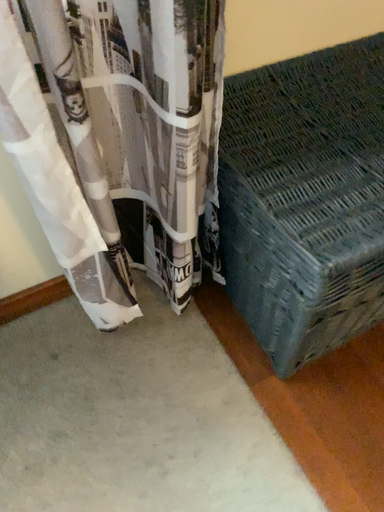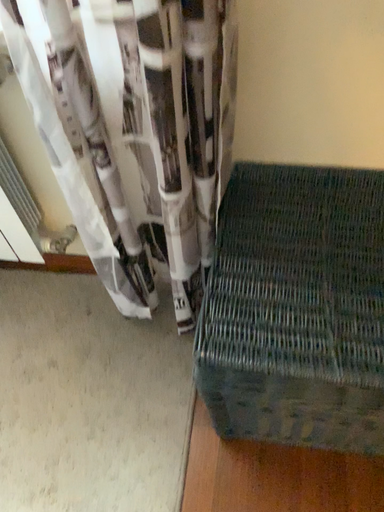
Question: Which way did the camera rotate in the video?

Choices:
 (A) rotated right
 (B) rotated left

Answer: (B)